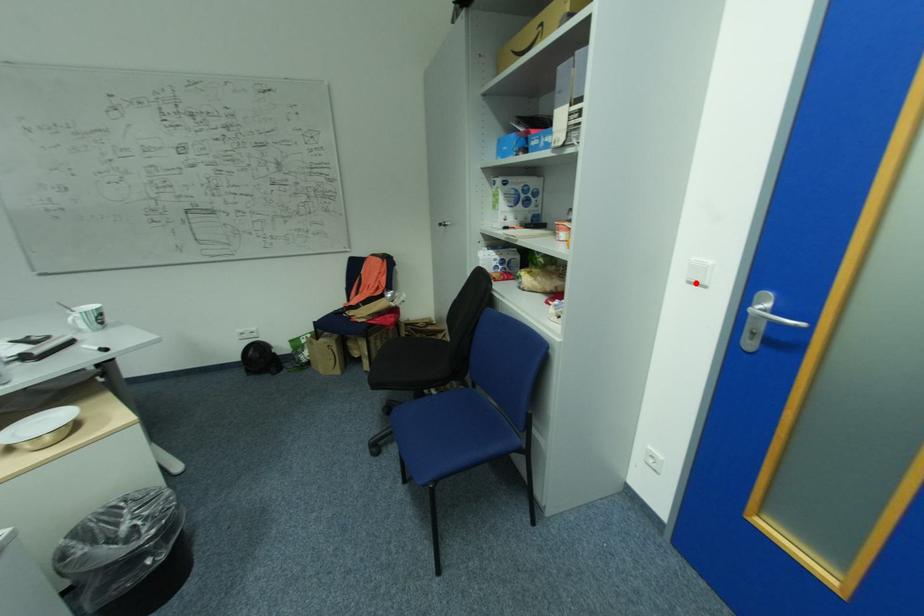
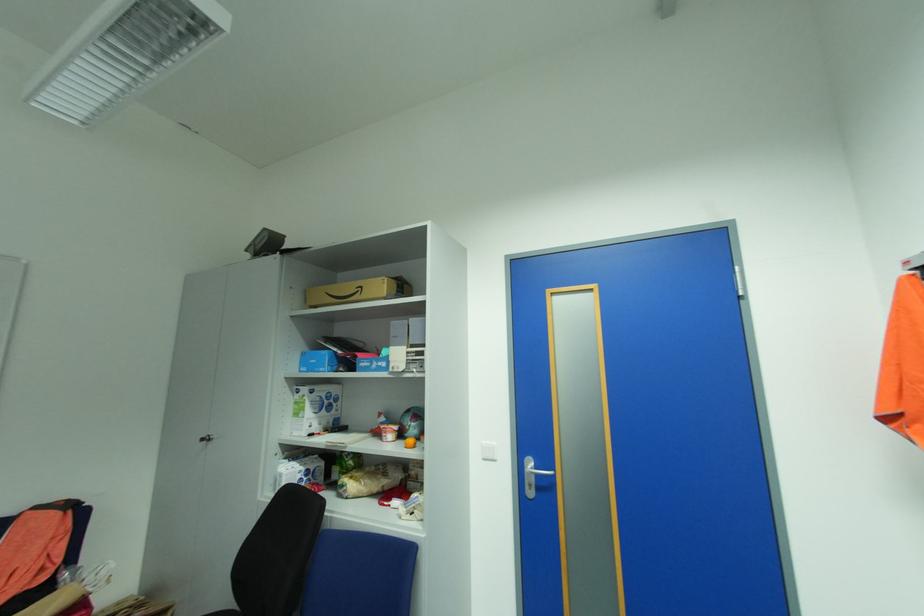
Question: I am providing you with two images of the same scene from different viewpoints. A red point is shown in image1. For the corresponding object point in image2, is it positioned nearer or farther from the camera?

Choices:
 (A) Nearer
 (B) Farther

Answer: (B)